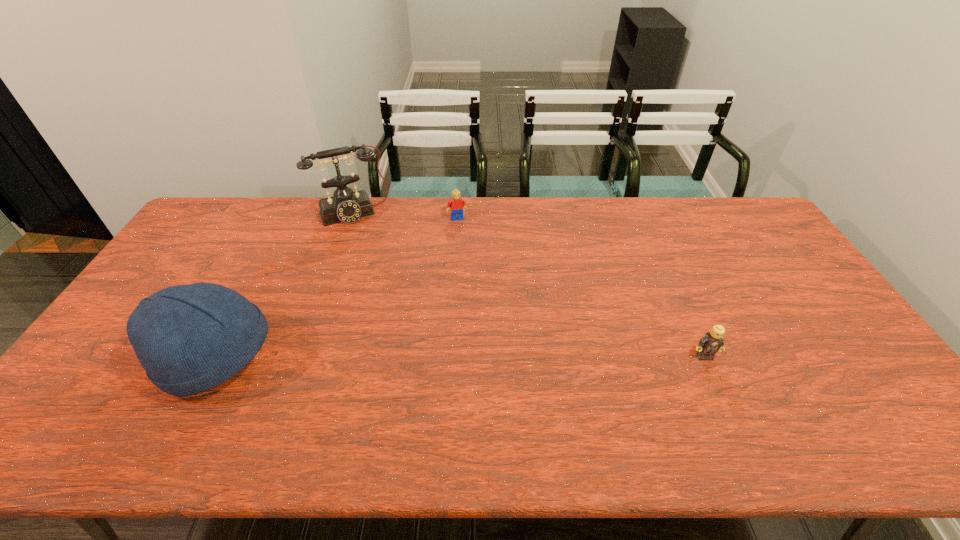
Locate an element on the screen. skullcap is located at coordinates (190, 338).

Identify the location of the rightmost object. Image resolution: width=960 pixels, height=540 pixels. (709, 344).

Where is `the nearer Lego`? the nearer Lego is located at coordinates (709, 344).

This screenshot has width=960, height=540. Identify the location of the left Lego. pyautogui.click(x=457, y=204).

What are the coordinates of `the third object from left to right` in the screenshot? It's located at (457, 204).

The height and width of the screenshot is (540, 960). Find the location of `telephone`. telephone is located at coordinates (346, 206).

Identify the location of vacant space located on the back of the third shortest object. The image size is (960, 540). (272, 251).

At what (x,y) coordinates should I click in order to perform the action: click on vacant space located 0.070m in front of the rightmost object. Please return your answer as a coordinate pair (x, y). Looking at the image, I should click on (716, 384).

The height and width of the screenshot is (540, 960). Find the location of `free region located 0.080m on the face of the second object from right to left`. free region located 0.080m on the face of the second object from right to left is located at coordinates (464, 235).

Where is `free space located on the face of the second object from right to left`? free space located on the face of the second object from right to left is located at coordinates (475, 269).